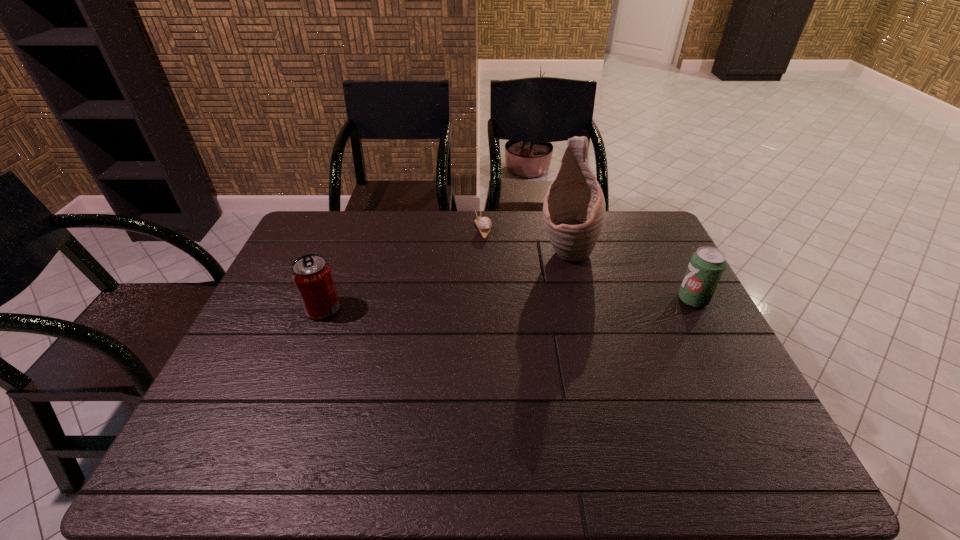
Where is `free location at the left edge`? This screenshot has height=540, width=960. free location at the left edge is located at coordinates (297, 308).

Where is `vacant space at the right edge of the desktop`? The image size is (960, 540). vacant space at the right edge of the desktop is located at coordinates (677, 367).

You are a GUI agent. You are given a task and a screenshot of the screen. Output one action in this format:
    pyautogui.click(x=<x>, y=<y>)
    Task: Click on the vacant space at the far left corner of the desktop
    
    Given the screenshot: What is the action you would take?
    pyautogui.click(x=292, y=244)

Where is `vacant area at the near right corner`? The height and width of the screenshot is (540, 960). vacant area at the near right corner is located at coordinates (729, 416).

Find the location of a particular element. The height and width of the screenshot is (540, 960). unoccupied area between the rightmost object and the second object from left to right is located at coordinates (588, 264).

In order to click on free area in between the rightmost object and the third object from left to right in this screenshot , I will do `click(630, 275)`.

At what (x,y) coordinates should I click in order to perform the action: click on vacant region between the escargot and the rightmost object. Please return your answer as a coordinate pair (x, y). This screenshot has height=540, width=960. Looking at the image, I should click on (588, 264).

The image size is (960, 540). In order to click on free space between the left soda and the pitcher in this screenshot , I will do `click(444, 280)`.

This screenshot has width=960, height=540. In order to click on vacant space that's between the escargot and the leftmost object in this screenshot , I will do `click(403, 269)`.

Locate an element on the screen. The image size is (960, 540). vacant area between the pitcher and the right soda is located at coordinates (630, 275).